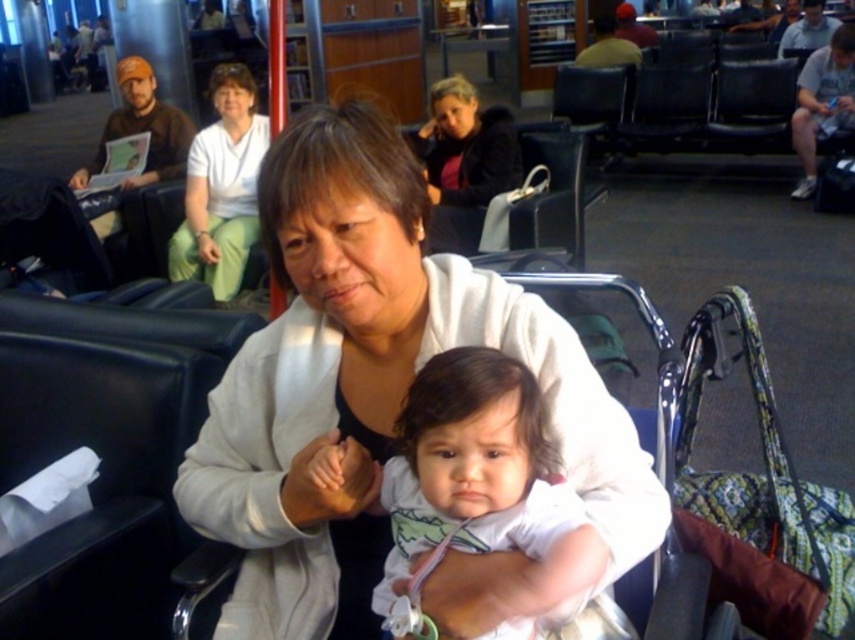
Question: Can you confirm if white soft jacket at center is bigger than matte black jacket at upper center?

Choices:
 (A) no
 (B) yes

Answer: (A)

Question: Can you confirm if white soft jacket at center is positioned above white fabric shirt at upper center?

Choices:
 (A) yes
 (B) no

Answer: (B)

Question: Which of the following is the closest to the observer?

Choices:
 (A) white soft jacket at center
 (B) matte black jacket at upper center

Answer: (A)

Question: Which point appears farthest from the camera in this image?

Choices:
 (A) [x=439, y=232]
 (B) [x=343, y=243]
 (C) [x=444, y=408]
 (D) [x=210, y=164]

Answer: (D)

Question: Is white soft jacket at center behind white fabric shirt at upper center?

Choices:
 (A) no
 (B) yes

Answer: (A)

Question: Considering the real-world distances, which object is farthest from the white soft fabric baby at center?

Choices:
 (A) white fabric shirt at upper center
 (B) white soft jacket at center
 (C) matte black jacket at upper center

Answer: (A)